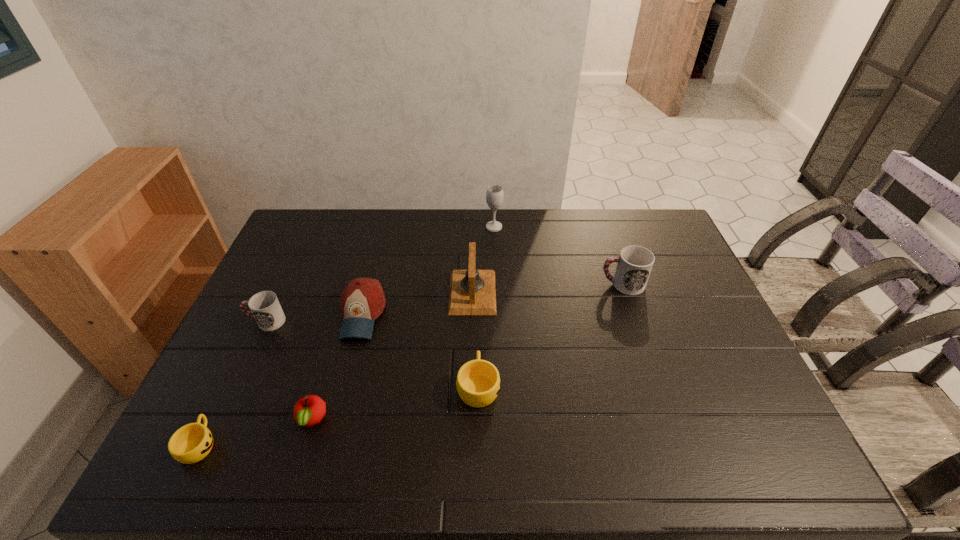
Locate an element on the screen. vacant space located on the right of the apple is located at coordinates (452, 420).

Locate an element on the screen. The image size is (960, 540). blank space located on the right of the left beige cup is located at coordinates (369, 444).

Locate an element on the screen. Image resolution: width=960 pixels, height=540 pixels. object at the far edge is located at coordinates (494, 195).

Locate an element on the screen. apple that is positioned at the near edge is located at coordinates (310, 410).

You are a GUI agent. You are given a task and a screenshot of the screen. Output one action in this format:
    pyautogui.click(x=<x>, y=<y>)
    Task: Click on the cup that is at the near edge
    Image resolution: width=960 pixels, height=540 pixels.
    Given the screenshot: What is the action you would take?
    pyautogui.click(x=191, y=443)

Where is `object that is at the near left corner`? This screenshot has height=540, width=960. object that is at the near left corner is located at coordinates (191, 443).

I want to click on vacant area at the far edge of the desktop, so click(x=347, y=215).

Image resolution: width=960 pixels, height=540 pixels. In order to click on free space at the left edge of the desktop in this screenshot , I will do `click(281, 293)`.

Locate an element on the screen. vacant space at the right edge is located at coordinates [x=701, y=366].

The width and height of the screenshot is (960, 540). I want to click on vacant space at the near right corner of the desktop, so click(782, 441).